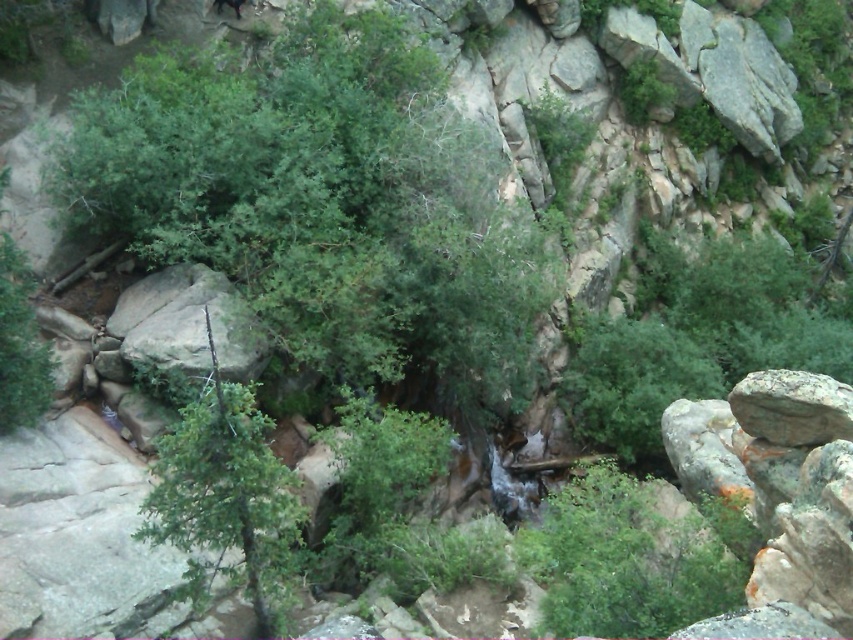
Question: Does green leafy tree at center appear under green leafy shrub at center?

Choices:
 (A) yes
 (B) no

Answer: (B)

Question: Which of the following is the closest to the observer?

Choices:
 (A) green leafy bush at center
 (B) green leafy shrub at center

Answer: (A)

Question: Among these points, which one is nearest to the camera?

Choices:
 (A) (369, 324)
 (B) (289, 529)

Answer: (B)

Question: Is green leafy bush at center above green textured tree at center?

Choices:
 (A) yes
 (B) no

Answer: (B)

Question: Does green leafy tree at center have a greater width compared to green leafy shrub at center?

Choices:
 (A) no
 (B) yes

Answer: (A)

Question: Which object is closer to the camera taking this photo?

Choices:
 (A) green leafy shrub at center
 (B) green textured tree at center
 (C) green leafy tree at center
 (D) green leafy bush at center

Answer: (D)